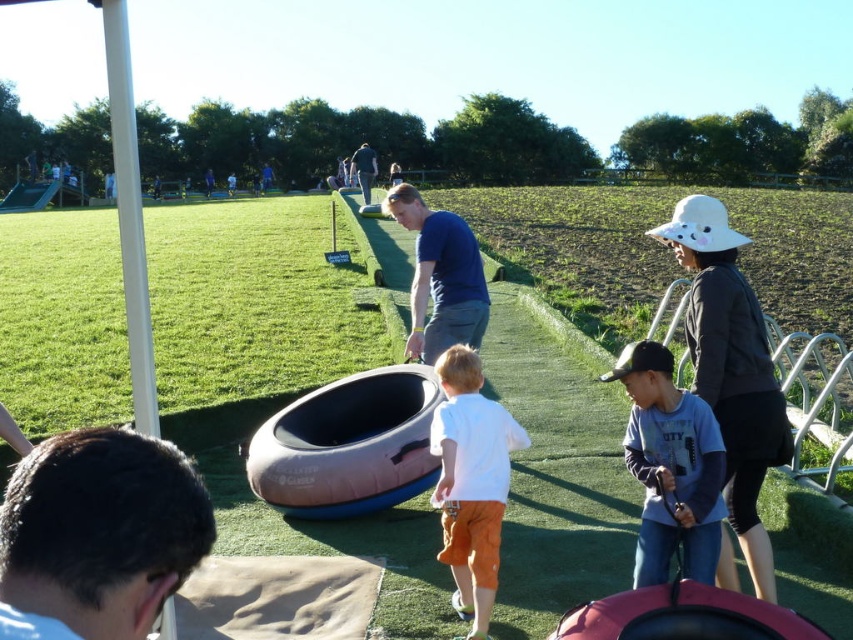
Question: Which point is farther to the camera?

Choices:
 (A) (469, 289)
 (B) (82, 486)
 (C) (485, 637)

Answer: (A)

Question: Estimate the real-world distances between objects in this image. Which object is farther from the blue shirt at center?

Choices:
 (A) brown hair at lower left
 (B) white cotton shirt at center
 (C) white fabric hat at right
 (D) blue cotton shirt at center

Answer: (A)

Question: From the image, what is the correct spatial relationship of white fabric hat at right in relation to white cotton shirt at center?

Choices:
 (A) left
 (B) right

Answer: (B)

Question: From the image, what is the correct spatial relationship of white fabric hat at right in relation to gray cotton shirt at center?

Choices:
 (A) left
 (B) right

Answer: (B)

Question: Which object is closer to the camera taking this photo?

Choices:
 (A) blue cotton shirt at center
 (B) white cotton shirt at center

Answer: (B)

Question: Considering the relative positions of brown hair at lower left and gray cotton shirt at center in the image provided, where is brown hair at lower left located with respect to gray cotton shirt at center?

Choices:
 (A) left
 (B) right

Answer: (A)